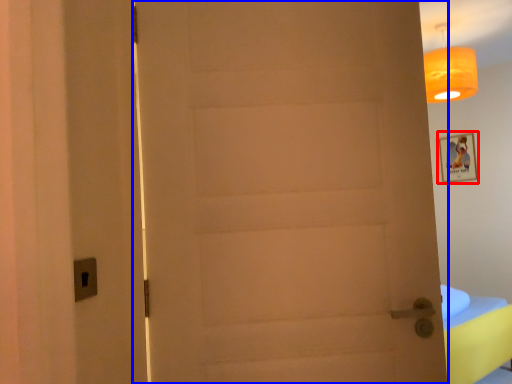
Question: Which object is closer to the camera taking this photo, picture frame (highlighted by a red box) or door (highlighted by a blue box)?

Choices:
 (A) picture frame
 (B) door

Answer: (B)